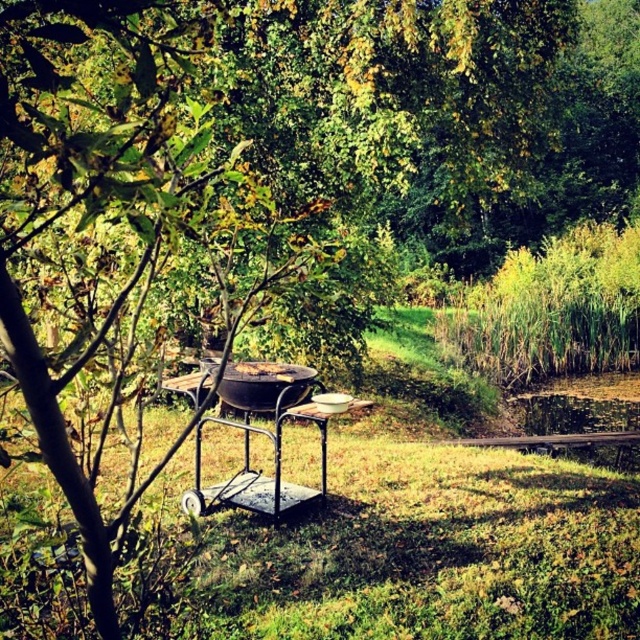
Question: Which object is the closest to the black matte grill at center?

Choices:
 (A) brown matte grill at center
 (B) metallic grill cart at center

Answer: (A)

Question: Does black matte grill at center appear on the left side of brown matte grill at center?

Choices:
 (A) yes
 (B) no

Answer: (A)

Question: Is metallic grill cart at center thinner than black matte grill at center?

Choices:
 (A) no
 (B) yes

Answer: (A)

Question: Which is nearer to the brown matte grill at center?

Choices:
 (A) metallic grill cart at center
 (B) black matte grill at center

Answer: (B)

Question: Which object appears farthest from the camera in this image?

Choices:
 (A) metallic grill cart at center
 (B) brown matte grill at center
 (C) black matte grill at center

Answer: (B)

Question: Considering the relative positions of metallic grill cart at center and black matte grill at center in the image provided, where is metallic grill cart at center located with respect to black matte grill at center?

Choices:
 (A) above
 (B) below

Answer: (B)